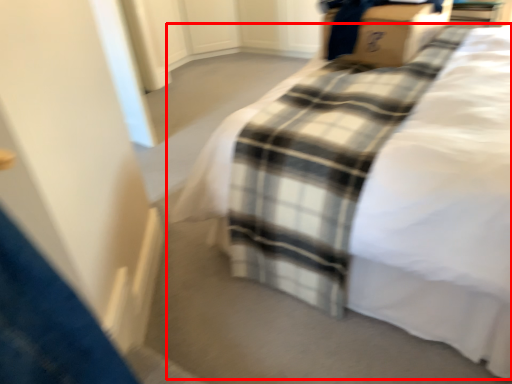
Question: Where is bed (annotated by the red box) located in relation to cardboard box in the image?

Choices:
 (A) right
 (B) left

Answer: (B)